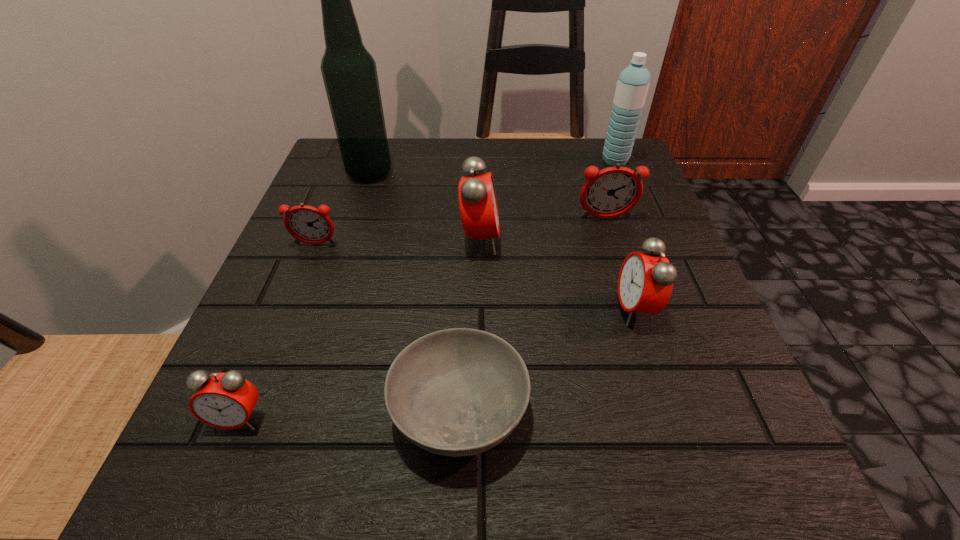
Find the location of a particular element. The image size is (960, 540). green alcohol is located at coordinates (349, 72).

Where is `the tallest object`? the tallest object is located at coordinates (349, 72).

At what (x,y) coordinates should I click in order to perform the action: click on water bottle. Please return your answer as a coordinate pair (x, y). The image size is (960, 540). Looking at the image, I should click on (632, 86).

The image size is (960, 540). In order to click on the seventh shortest object in this screenshot , I will do `click(632, 86)`.

This screenshot has height=540, width=960. Find the location of `the tallest alarm clock`. the tallest alarm clock is located at coordinates (478, 207).

At what (x,y) coordinates should I click in order to perform the action: click on the farthest red alarm clock. Please return your answer as a coordinate pair (x, y). The image size is (960, 540). Looking at the image, I should click on (478, 207).

At what (x,y) coordinates should I click in order to perform the action: click on the farther reddish-pink alarm clock. Please return your answer as a coordinate pair (x, y). This screenshot has height=540, width=960. Looking at the image, I should click on (611, 192).

This screenshot has width=960, height=540. Find the location of `the right reddish-pink alarm clock`. the right reddish-pink alarm clock is located at coordinates (611, 192).

Locate an element on the screen. This screenshot has width=960, height=540. the second nearest red alarm clock is located at coordinates (645, 283).

The height and width of the screenshot is (540, 960). I want to click on the fourth farthest alarm clock, so click(x=645, y=283).